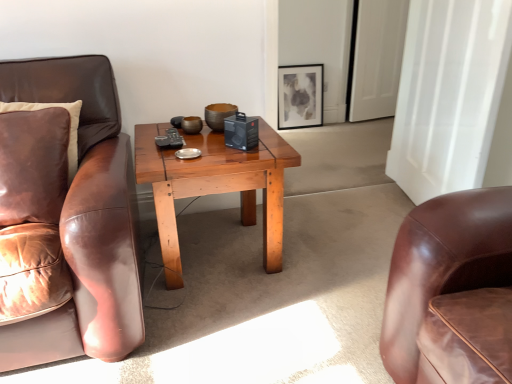
Question: In the image, is leather pillow at left positioned in front of or behind matte black picture frame at upper center?

Choices:
 (A) front
 (B) behind

Answer: (A)

Question: From a real-world perspective, is leather pillow at left above or below matte black picture frame at upper center?

Choices:
 (A) above
 (B) below

Answer: (A)

Question: Which of these objects is positioned closest to the wooden coffee table at center?

Choices:
 (A) leather pillow at left
 (B) matte black picture frame at upper center
 (C) white glossy door at upper right

Answer: (A)

Question: Which of these objects is positioned closest to the matte black picture frame at upper center?

Choices:
 (A) white glossy door at upper right
 (B) wooden coffee table at center
 (C) leather pillow at left

Answer: (A)